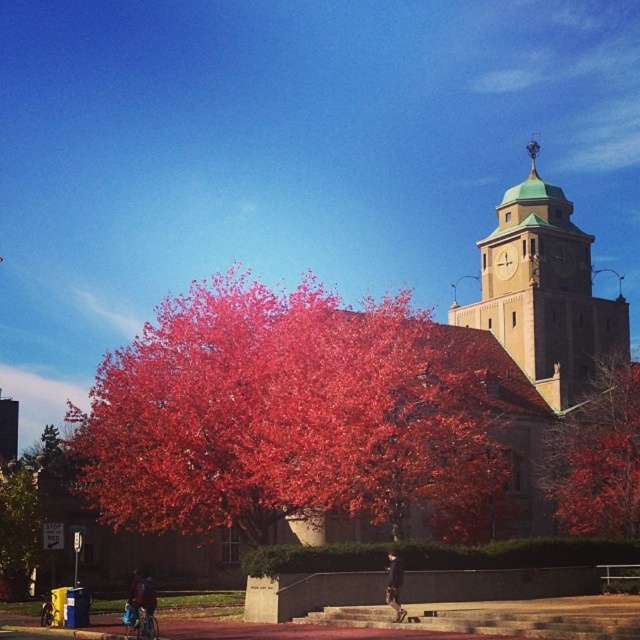
Question: Based on their relative distances, which object is farther from the bright red leaves at center?

Choices:
 (A) green leafy tree at lower left
 (B) smooth red tree at center
 (C) green copper clock tower at upper right

Answer: (C)

Question: Can you confirm if bright red leaves at center is positioned to the left of green leafy tree at lower left?

Choices:
 (A) yes
 (B) no

Answer: (B)

Question: Which point is closer to the camera?

Choices:
 (A) (205, 522)
 (B) (22, 588)

Answer: (A)

Question: Which object is farther from the camera taking this photo?

Choices:
 (A) bright red leaves at center
 (B) smooth red tree at center

Answer: (B)

Question: Is green copper clock tower at upper right positioned behind green leafy tree at lower left?

Choices:
 (A) yes
 (B) no

Answer: (A)

Question: Can you confirm if green copper clock tower at upper right is positioned to the right of green leafy tree at lower left?

Choices:
 (A) no
 (B) yes

Answer: (B)